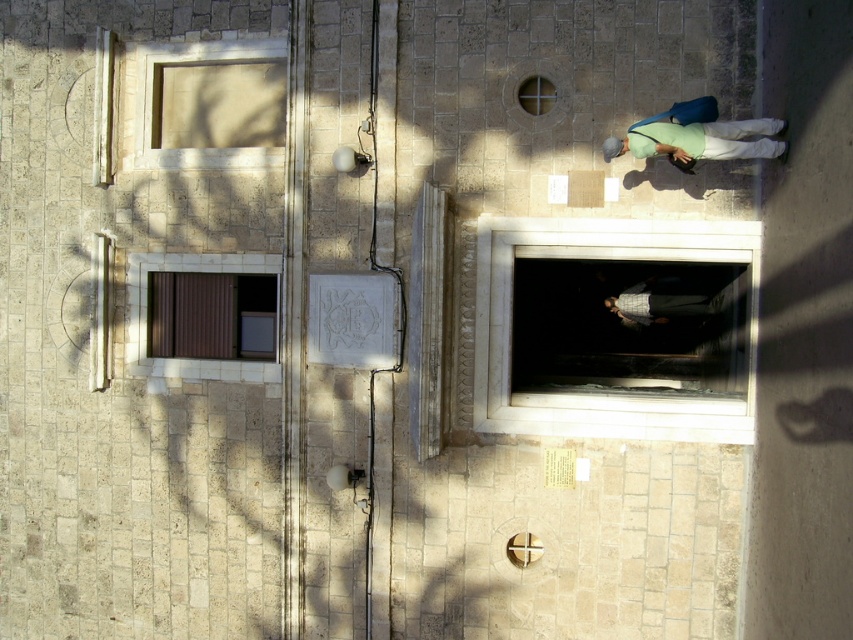
Question: Which of the following is the farthest from the observer?

Choices:
 (A) beige stone window at upper left
 (B) green fabric at center
 (C) plaid fabric shirt at center
 (D) white marble window at center

Answer: (C)

Question: Which object is farther from the camera taking this photo?

Choices:
 (A) green fabric at center
 (B) brown matte window at upper left

Answer: (B)

Question: Considering the relative positions of brown matte window at upper left and plaid fabric shirt at center in the image provided, where is brown matte window at upper left located with respect to plaid fabric shirt at center?

Choices:
 (A) right
 (B) left

Answer: (B)

Question: Considering the relative positions of white marble window at center and plaid fabric shirt at center in the image provided, where is white marble window at center located with respect to plaid fabric shirt at center?

Choices:
 (A) right
 (B) left

Answer: (B)

Question: Does white marble window at center come behind plaid fabric shirt at center?

Choices:
 (A) no
 (B) yes

Answer: (A)

Question: Estimate the real-world distances between objects in this image. Which object is farther from the green fabric at center?

Choices:
 (A) beige stone window at upper left
 (B) brown matte window at upper left
 (C) white marble window at center

Answer: (B)